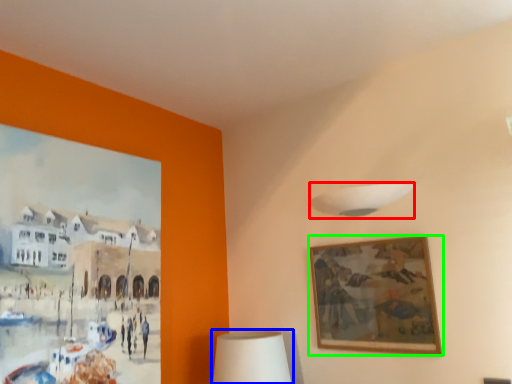
Question: Which is nearer to the lamp (highlighted by a red box)? table lamp (highlighted by a blue box) or picture frame (highlighted by a green box).

Choices:
 (A) table lamp
 (B) picture frame

Answer: (B)